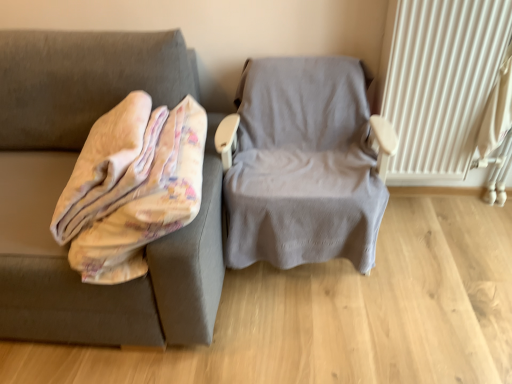
Question: From the image's perspective, is white textured radiator at right on top of gray fabric chair at center?

Choices:
 (A) no
 (B) yes

Answer: (B)

Question: From a real-world perspective, is white textured radiator at right located beneath gray fabric chair at center?

Choices:
 (A) no
 (B) yes

Answer: (A)

Question: Is white textured radiator at right placed right next to gray fabric chair at center?

Choices:
 (A) no
 (B) yes

Answer: (A)

Question: Could you tell me if white textured radiator at right is turned towards gray fabric chair at center?

Choices:
 (A) no
 (B) yes

Answer: (A)

Question: Considering the relative sizes of white textured radiator at right and gray fabric chair at center in the image provided, is white textured radiator at right wider than gray fabric chair at center?

Choices:
 (A) no
 (B) yes

Answer: (A)

Question: From a real-world perspective, does white textured radiator at right stand above gray fabric chair at center?

Choices:
 (A) no
 (B) yes

Answer: (B)

Question: Does fluffy beige blanket at left come behind gray fabric chair at center?

Choices:
 (A) no
 (B) yes

Answer: (A)

Question: Is fluffy beige blanket at left far away from gray fabric chair at center?

Choices:
 (A) yes
 (B) no

Answer: (B)

Question: Does fluffy beige blanket at left have a larger size compared to gray fabric chair at center?

Choices:
 (A) no
 (B) yes

Answer: (A)

Question: Can you confirm if fluffy beige blanket at left is shorter than gray fabric chair at center?

Choices:
 (A) yes
 (B) no

Answer: (A)

Question: From a real-world perspective, is fluffy beige blanket at left positioned under gray fabric chair at center based on gravity?

Choices:
 (A) yes
 (B) no

Answer: (B)

Question: Is the position of fluffy beige blanket at left less distant than that of gray fabric chair at center?

Choices:
 (A) yes
 (B) no

Answer: (A)

Question: Does white textured radiator at right turn towards fluffy beige blanket at left?

Choices:
 (A) no
 (B) yes

Answer: (A)